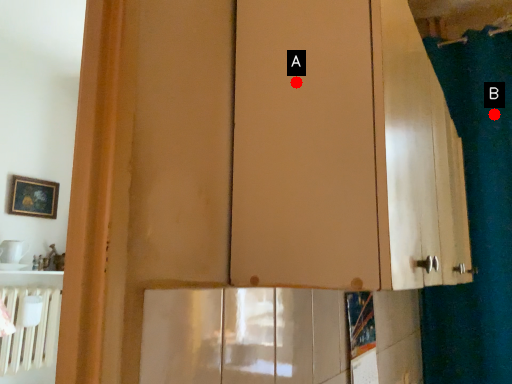
Question: Two points are circled on the image, labeled by A and B beside each circle. Among these points, which one is nearest to the camera?

Choices:
 (A) A is closer
 (B) B is closer

Answer: (A)